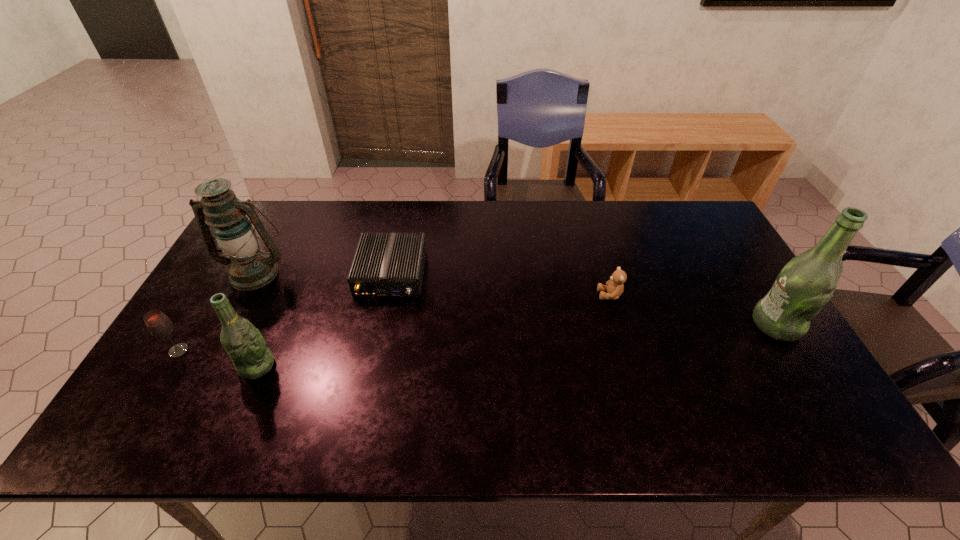
Image resolution: width=960 pixels, height=540 pixels. I want to click on free space for an extra beer_bottle to achieve even spacing, so click(x=528, y=345).